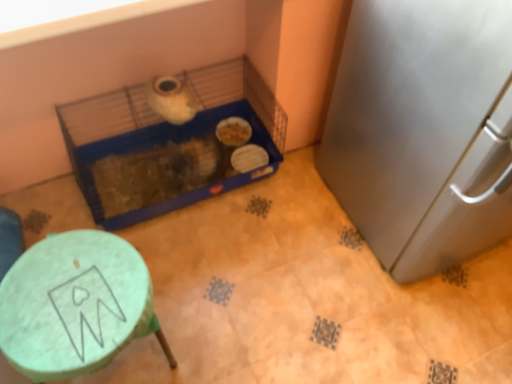
Locate an element on the screen. The width and height of the screenshot is (512, 384). vacant area that is in front of satin silver refrigerator at right is located at coordinates (408, 324).